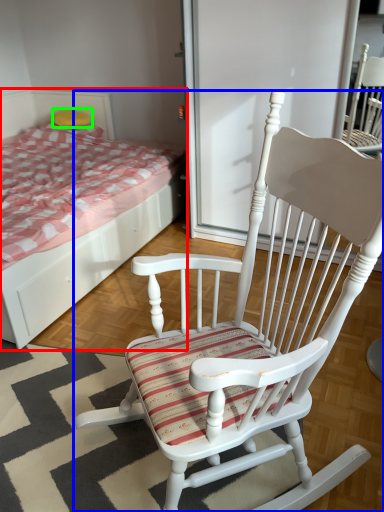
Question: Which object is positioned closest to bed (highlighted by a red box)? Select from chair (highlighted by a blue box) and pillow (highlighted by a green box).

Choices:
 (A) chair
 (B) pillow

Answer: (A)